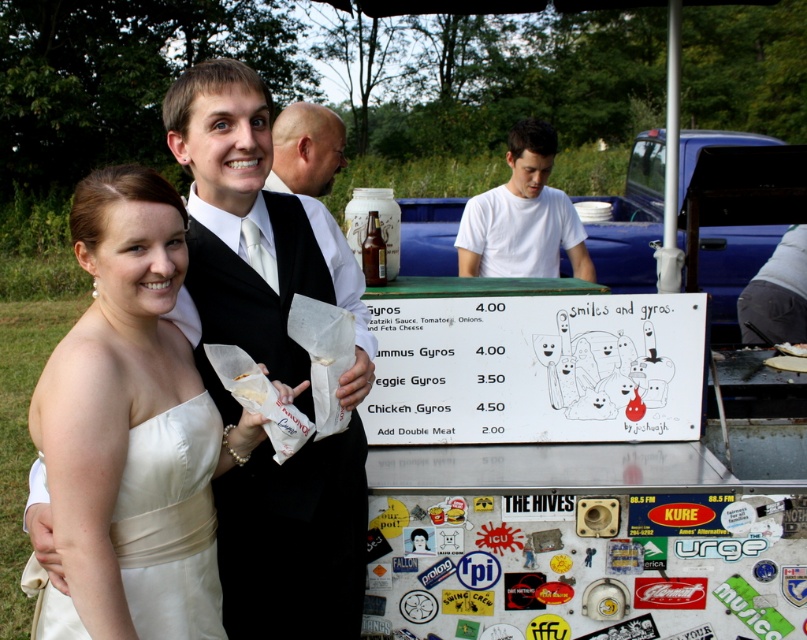
You are a photographer at a wedding reception and need to capture a photo of the white satin dress at left and the white matte shirt at center. The camera you are using has a limited depth of field. Which object should you focus on to ensure it appears sharp and in focus, considering their positions?

The white satin dress at left is much taller than the white matte shirt at center. Therefore, to ensure the white satin dress at left appears sharp, focus on it since it is farther away from the camera.

You are a photographer at the event and want to ensure both the white satin dress at center and the smooth bald head at center are clearly visible in your photo. Considering their heights, which one should you focus on first to ensure proper focus?

The white satin dress at center is taller than the smooth bald head at center, so you should focus on the white satin dress at center first to ensure proper focus.